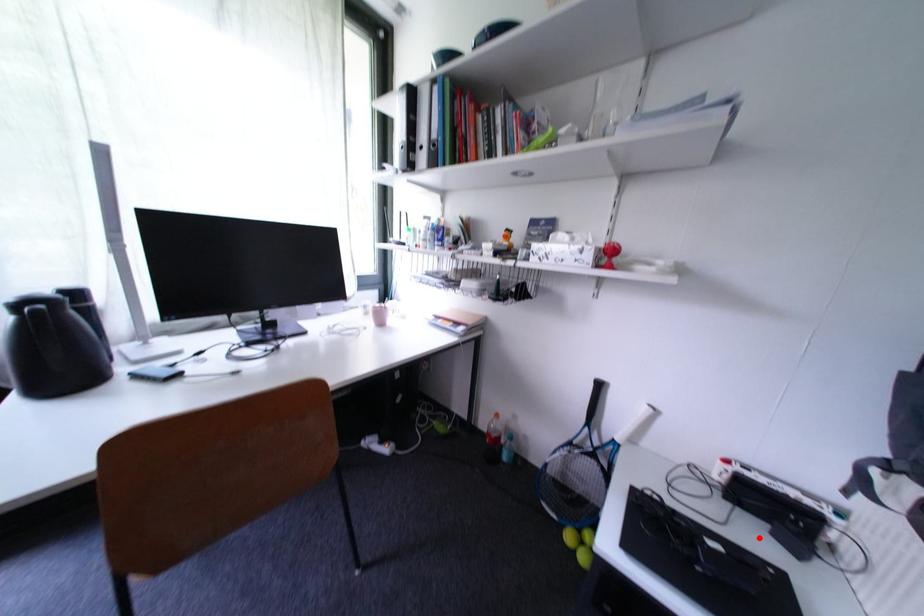
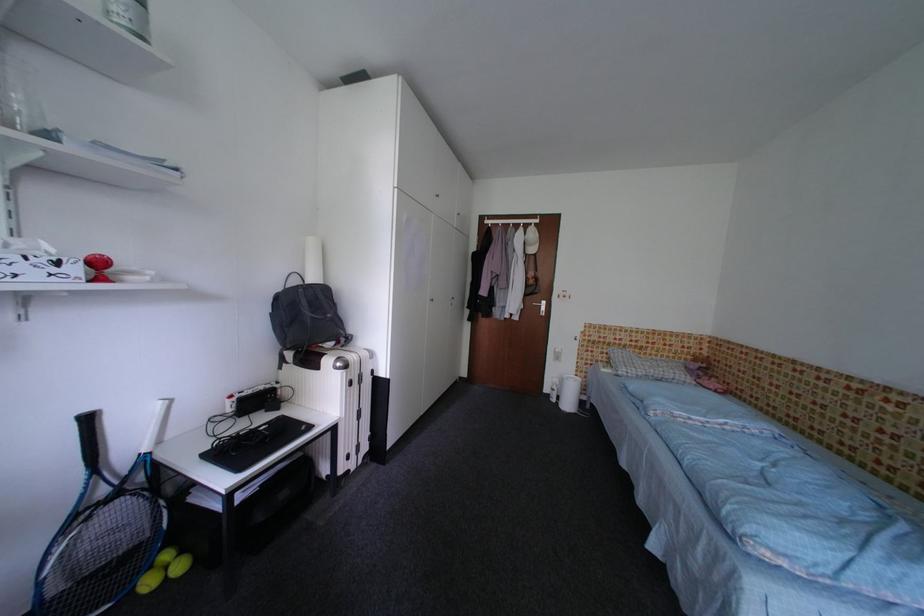
Question: I am providing you with two images of the same scene from different viewpoints. A red point is marked on the first image. At the location where the point appears in image 1, is it still visible in image 2?

Choices:
 (A) Yes
 (B) No

Answer: (A)